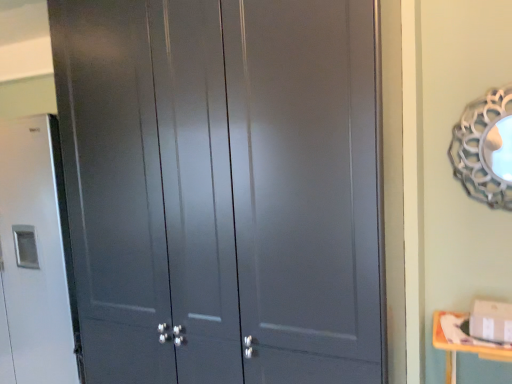
Question: Relative to yellow wood changing table at lower right, is matte gray cabinet at left in front or behind?

Choices:
 (A) behind
 (B) front

Answer: (A)

Question: Is matte gray cabinet at left taller or shorter than yellow wood changing table at lower right?

Choices:
 (A) short
 (B) tall

Answer: (B)

Question: Which of these objects is positioned farthest from the metallic silver mirror at upper right?

Choices:
 (A) yellow wood changing table at lower right
 (B) matte gray cabinet at center
 (C) matte gray cabinet at left

Answer: (C)

Question: Which of these objects is positioned closest to the matte gray cabinet at left?

Choices:
 (A) matte gray cabinet at center
 (B) yellow wood changing table at lower right
 (C) metallic silver mirror at upper right

Answer: (A)